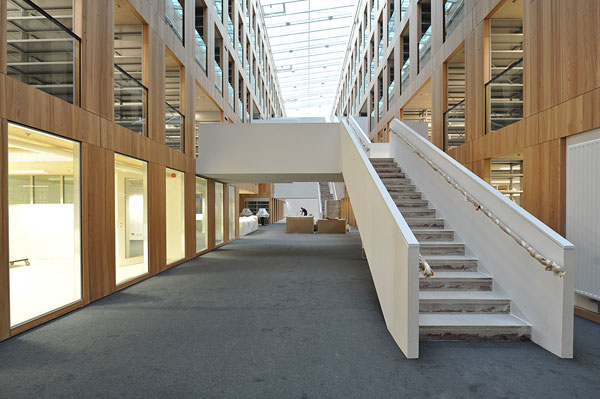
Identify the location of windows on the left. (40, 259), (135, 243), (175, 235), (196, 219), (223, 217), (235, 216).